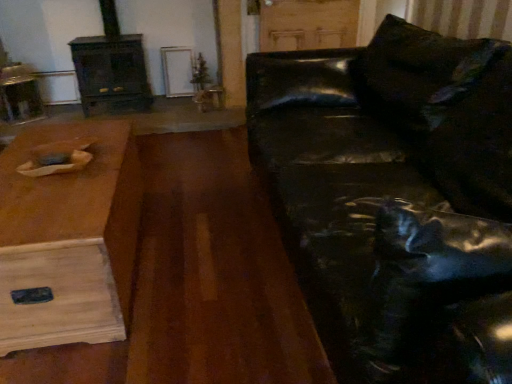
Image resolution: width=512 pixels, height=384 pixels. Find the location of `wooden table at left`. wooden table at left is located at coordinates (68, 238).

The image size is (512, 384). Find the location of `dark wood fireplace at left`. dark wood fireplace at left is located at coordinates (111, 66).

The image size is (512, 384). What are the coordinates of `table on the left of shiny black leather couch at right` in the screenshot? It's located at (x=68, y=238).

Considering the positions of objects shiny black leather couch at right and wooden table at left in the image provided, who is more to the right, shiny black leather couch at right or wooden table at left?

shiny black leather couch at right is more to the right.

Consider the image. Is shiny black leather couch at right turned away from wooden table at left?

No, shiny black leather couch at right's orientation is not away from wooden table at left.

From the image's perspective, which is below, shiny black leather couch at right or dark wood fireplace at left?

shiny black leather couch at right is shown below in the image.

Visually, is shiny black leather couch at right positioned to the left or to the right of dark wood fireplace at left?

shiny black leather couch at right is to the right of dark wood fireplace at left.

From a real-world perspective, is shiny black leather couch at right physically located above or below dark wood fireplace at left?

Clearly, from a real-world perspective, shiny black leather couch at right is below dark wood fireplace at left.

Looking at this image, from a real-world perspective, relative to shiny black leather couch at right, is wooden table at left vertically above or below?

wooden table at left is below shiny black leather couch at right.

Which of these two, wooden table at left or shiny black leather couch at right, is bigger?

shiny black leather couch at right is bigger.

Who is shorter, wooden table at left or shiny black leather couch at right?

With less height is wooden table at left.

Does point (89, 223) lie in front of point (342, 303)?

No, it is not.

Can you tell me how much wooden table at left and dark wood fireplace at left differ in facing direction?

The angle between the facing direction of wooden table at left and the facing direction of dark wood fireplace at left is 91.7 degrees.

Considering the sizes of wooden table at left and dark wood fireplace at left in the image, is wooden table at left bigger or smaller than dark wood fireplace at left?

wooden table at left is smaller than dark wood fireplace at left.

I want to click on fireplace that is above the wooden table at left (from a real-world perspective), so click(x=111, y=66).

From the picture: Visually, is wooden table at left positioned to the left or to the right of dark wood fireplace at left?

In the image, wooden table at left appears on the right side of dark wood fireplace at left.

Is dark wood fireplace at left in contact with shiny black leather couch at right?

dark wood fireplace at left and shiny black leather couch at right are not in contact.

Which of these two, dark wood fireplace at left or shiny black leather couch at right, is bigger?

shiny black leather couch at right is bigger.

In the image, is dark wood fireplace at left positioned in front of or behind shiny black leather couch at right?

Clearly, dark wood fireplace at left is behind shiny black leather couch at right.

Considering the relative sizes of dark wood fireplace at left and shiny black leather couch at right in the image provided, is dark wood fireplace at left wider than shiny black leather couch at right?

No, dark wood fireplace at left is not wider than shiny black leather couch at right.

Is dark wood fireplace at left positioned far away from wooden table at left?

Yes.

Which of these two, dark wood fireplace at left or wooden table at left, stands shorter?

wooden table at left is shorter.

Visually, is dark wood fireplace at left positioned to the left or to the right of wooden table at left?

dark wood fireplace at left is positioned on wooden table at left's left side.

Which point is more distant from viewer, (99, 79) or (68, 326)?

The point (99, 79) is farther from the camera.

This screenshot has width=512, height=384. I want to click on table located underneath the shiny black leather couch at right (from a real-world perspective), so click(68, 238).

At what (x,y) coordinates should I click in order to perform the action: click on fireplace above the shiny black leather couch at right (from the image's perspective). Please return your answer as a coordinate pair (x, y). Looking at the image, I should click on (111, 66).

Considering their positions, is shiny black leather couch at right positioned closer to dark wood fireplace at left than wooden table at left?

wooden table at left lies closer to dark wood fireplace at left than the other object.

Estimate the real-world distances between objects in this image. Which object is further from wooden table at left, shiny black leather couch at right or dark wood fireplace at left?

dark wood fireplace at left is further to wooden table at left.

Estimate the real-world distances between objects in this image. Which object is closer to shiny black leather couch at right, dark wood fireplace at left or wooden table at left?

wooden table at left is closer to shiny black leather couch at right.

Based on their spatial positions, is wooden table at left or dark wood fireplace at left further from shiny black leather couch at right?

Among the two, dark wood fireplace at left is located further to shiny black leather couch at right.

Based on their spatial positions, is dark wood fireplace at left or shiny black leather couch at right further from wooden table at left?

dark wood fireplace at left.

Based on their spatial positions, is wooden table at left or shiny black leather couch at right closer to dark wood fireplace at left?

wooden table at left lies closer to dark wood fireplace at left than the other object.

This screenshot has width=512, height=384. What are the coordinates of `table between shiny black leather couch at right and dark wood fireplace at left from front to back` in the screenshot? It's located at (68, 238).